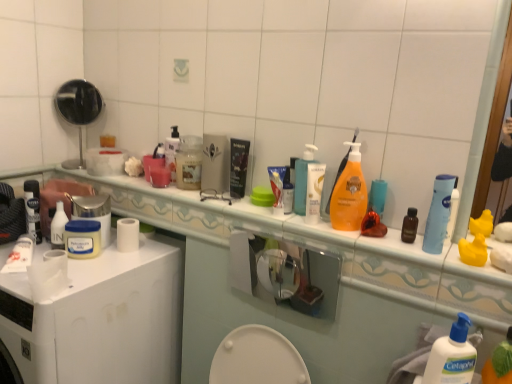
At what (x,y) coordinates should I click in order to perform the action: click on translucent plastic tube at center, which appears as the 2th toiletry when viewed from the back. Please return your answer as a coordinate pair (x, y). The height and width of the screenshot is (384, 512). Looking at the image, I should click on (288, 192).

Where is `white glossy counter top at upper center`? The image size is (512, 384). white glossy counter top at upper center is located at coordinates (270, 225).

Describe the element at coordinates (270, 225) in the screenshot. I see `white glossy counter top at upper center` at that location.

In order to face white plastic container at center, should I rotate leftwards or rightwards?

Rotate your view left by about 20.590°.

Image resolution: width=512 pixels, height=384 pixels. I want to click on white matte jar at center-left, the 3th toiletry from the front, so click(x=58, y=227).

In order to face translucent plastic pump bottle at center, acting as the second cleaning product starting from the top, should I rotate leftwards or rightwards?

You should rotate right by 7.010 degrees.

I want to click on translucent plastic tube at center, the second toiletry from the right, so click(288, 192).

From a real-world perspective, is white plastic jar at upper left, arranged as the second mouthwash when viewed from the back, beneath matte black tube at center?

Yes, from a real-world perspective, white plastic jar at upper left, arranged as the second mouthwash when viewed from the back, is under matte black tube at center.

Can you tell me how much white plastic jar at upper left, arranged as the second mouthwash when viewed from the back, and matte black tube at center differ in facing direction?

41.7 degrees.

Who is bigger, white plastic jar at upper left, acting as the third mouthwash starting from the right, or matte black tube at center?

With larger size is white plastic jar at upper left, acting as the third mouthwash starting from the right.

Is white plastic washing machine at lower left oriented towards orange plastic bottle at center, arranged as the 2th cleaning product when viewed from the left?

No.

Find the location of a particular element. the 3rd cleaning product above when counting from the white plastic washing machine at lower left (from the image's perspective) is located at coordinates (348, 192).

Is point (59, 338) positioned behind point (335, 222)?

No, it is in front of (335, 222).

Considering the points (175, 160) and (312, 187), which point is in front, point (175, 160) or point (312, 187)?

Point (312, 187)

In terms of size, does translucent plastic jar at center, marked as the 2th mouthwash in a right-to-left arrangement, appear bigger or smaller than white glossy lotion at center, which appears as the first toiletry when viewed from the right?

Clearly, translucent plastic jar at center, marked as the 2th mouthwash in a right-to-left arrangement, is larger in size than white glossy lotion at center, which appears as the first toiletry when viewed from the right.

Measure the distance between translucent plastic jar at center, marked as the 2th mouthwash in a right-to-left arrangement, and white glossy lotion at center, the first toiletry from the front.

translucent plastic jar at center, marked as the 2th mouthwash in a right-to-left arrangement, and white glossy lotion at center, the first toiletry from the front, are 17.73 inches apart.

Is translucent plastic jar at center, the 1th mouthwash when ordered from back to front, at the right side of white glossy lotion at center, which appears as the first toiletry when viewed from the right?

No.

Is polished silver mirror at upper left to the left of white matte jar at center-left, the 1th toiletry in the left-to-right sequence, from the viewer's perspective?

Correct, you'll find polished silver mirror at upper left to the left of white matte jar at center-left, the 1th toiletry in the left-to-right sequence.

Is polished silver mirror at upper left turned away from white matte jar at center-left, the first toiletry positioned from the back?

No, white matte jar at center-left, the first toiletry positioned from the back, is not at the back of polished silver mirror at upper left.

Considering the sizes of polished silver mirror at upper left and white matte jar at center-left, the 1th toiletry in the left-to-right sequence, in the image, is polished silver mirror at upper left taller or shorter than white matte jar at center-left, the 1th toiletry in the left-to-right sequence,?

polished silver mirror at upper left is taller than white matte jar at center-left, the 1th toiletry in the left-to-right sequence.

Can you confirm if polished silver mirror at upper left is wider than white matte jar at center-left, the first toiletry positioned from the back?

Indeed, polished silver mirror at upper left has a greater width compared to white matte jar at center-left, the first toiletry positioned from the back.

Which of these two, orange plastic bottle at center, acting as the second cleaning product starting from the back, or white glossy counter top at upper center, stands taller?

With more height is orange plastic bottle at center, acting as the second cleaning product starting from the back.

Considering the positions of points (344, 199) and (117, 180), is point (344, 199) farther from camera compared to point (117, 180)?

No, (344, 199) is in front of (117, 180).

Does orange plastic bottle at center, positioned as the 2th cleaning product in front-to-back order, have a larger size compared to white glossy counter top at upper center?

Actually, orange plastic bottle at center, positioned as the 2th cleaning product in front-to-back order, might be smaller than white glossy counter top at upper center.

Between translucent plastic jar at center, the third mouthwash when ordered from front to back, and white plastic container at center, which one is positioned in front?

white plastic container at center is closer to the camera.

Is translucent plastic jar at center, the third mouthwash when ordered from front to back, located outside white plastic container at center?

Yes, translucent plastic jar at center, the third mouthwash when ordered from front to back, is located beyond the bounds of white plastic container at center.

Between point (192, 157) and point (109, 230), which one is positioned in front?

The point (192, 157) is closer.

Is translucent plastic jar at center, which is the 2th mouthwash from left to right, positioned with its back to white plastic container at center?

translucent plastic jar at center, which is the 2th mouthwash from left to right, is not turned away from white plastic container at center.

What's the angular difference between white glossy lotion at center, the 3th toiletry positioned from the left, and white pump bottle at center right, marked as the first cleaning product in a right-to-left arrangement,'s facing directions?

The facing directions of white glossy lotion at center, the 3th toiletry positioned from the left, and white pump bottle at center right, marked as the first cleaning product in a right-to-left arrangement, are 9.75 degrees apart.

From the picture: Is white glossy lotion at center, the 3th toiletry from the back, outside of white pump bottle at center right, arranged as the 1th cleaning product when ordered from the bottom?

Indeed, white glossy lotion at center, the 3th toiletry from the back, is completely outside white pump bottle at center right, arranged as the 1th cleaning product when ordered from the bottom.

Is point (318, 179) closer or farther from the camera than point (448, 370)?

Point (318, 179) is farther from the camera than point (448, 370).

This screenshot has height=384, width=512. I want to click on product located behind the white plastic jar at upper left, acting as the third mouthwash starting from the right, so click(x=238, y=167).

From the white plastic washing machine at lower left, count 2nd cleaning product to the right and point to it. Please provide its 2D coordinates.

[(348, 192)]

When comparing their distances from white matte jar at center-left, the 3th toiletry from the front, does translucent plastic tube at center, which appears as the 2th toiletry when viewed from the back, or white pump bottle at center right, the third cleaning product from the back, seem closer?

The object closer to white matte jar at center-left, the 3th toiletry from the front, is translucent plastic tube at center, which appears as the 2th toiletry when viewed from the back.

Looking at the image, which one is located further to white glossy lotion at center, which appears as the first toiletry when viewed from the right, white matte jar at center-left, the 1th toiletry in the left-to-right sequence, or blue plastic tube at upper right, positioned as the third mouthwash in back-to-front order?

The object further to white glossy lotion at center, which appears as the first toiletry when viewed from the right, is white matte jar at center-left, the 1th toiletry in the left-to-right sequence.

From the image, which object appears to be farther from white glossy counter top at upper center, white plastic container at center or polished silver mirror at upper left?

polished silver mirror at upper left.

From the image, which object appears to be farther from orange plastic bottle at center, which is the 1th cleaning product in top-to-bottom order, white plastic jar at upper left, arranged as the second mouthwash when viewed from the back, or translucent plastic jar at center, marked as the 2th mouthwash in a right-to-left arrangement?

white plastic jar at upper left, arranged as the second mouthwash when viewed from the back, is further to orange plastic bottle at center, which is the 1th cleaning product in top-to-bottom order.

Considering their positions, is polished silver mirror at upper left positioned further to matte black tube at center than white glossy counter top at upper center?

Based on the image, polished silver mirror at upper left appears to be further to matte black tube at center.

From the image, which object appears to be farther from orange plastic bottle at center, which is the 1th cleaning product in top-to-bottom order, translucent plastic pump bottle at center, the 3th cleaning product positioned from the right, or blue plastic tube at upper right, positioned as the third mouthwash in back-to-front order?

Based on the image, blue plastic tube at upper right, positioned as the third mouthwash in back-to-front order, appears to be further to orange plastic bottle at center, which is the 1th cleaning product in top-to-bottom order.

Which object lies nearer to the anchor point white plastic container at center, white pump bottle at center right, acting as the third cleaning product starting from the top, or white plastic washing machine at lower left?

Among the two, white plastic washing machine at lower left is located nearer to white plastic container at center.

In the scene shown: Looking at the image, which one is located further to translucent plastic jar at center, marked as the 2th mouthwash in a right-to-left arrangement, translucent plastic tube at center, the 2th toiletry viewed from the left, or translucent plastic pump bottle at center, which is the first cleaning product in left-to-right order?

translucent plastic pump bottle at center, which is the first cleaning product in left-to-right order.

At what (x,y) coordinates should I click in order to perform the action: click on counter top between matte black tube at center and white plastic washing machine at lower left vertically. Please return your answer as a coordinate pair (x, y). Looking at the image, I should click on (270, 225).

Locate an element on the screen. Image resolution: width=512 pixels, height=384 pixels. appliance situated between white plastic jar at upper left, the 1th mouthwash viewed from the left, and translucent plastic jar at center, which is the 2th mouthwash from left to right, from left to right is located at coordinates (93, 212).

The height and width of the screenshot is (384, 512). Identify the location of mouthwash situated between white plastic jar at upper left, acting as the third mouthwash starting from the right, and matte black tube at center from left to right. (189, 162).

Where is `counter top between white plastic container at center and white pump bottle at center right, the 1th cleaning product viewed from the front`? counter top between white plastic container at center and white pump bottle at center right, the 1th cleaning product viewed from the front is located at coordinates (270, 225).